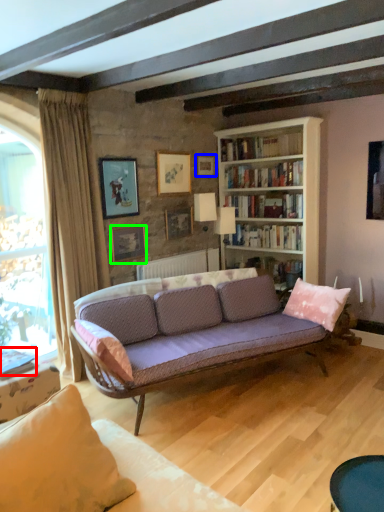
Question: Estimate the real-world distances between objects in this image. Which object is farther from book (highlighted by a red box), picture frame (highlighted by a blue box) or picture frame (highlighted by a green box)?

Choices:
 (A) picture frame
 (B) picture frame

Answer: (A)